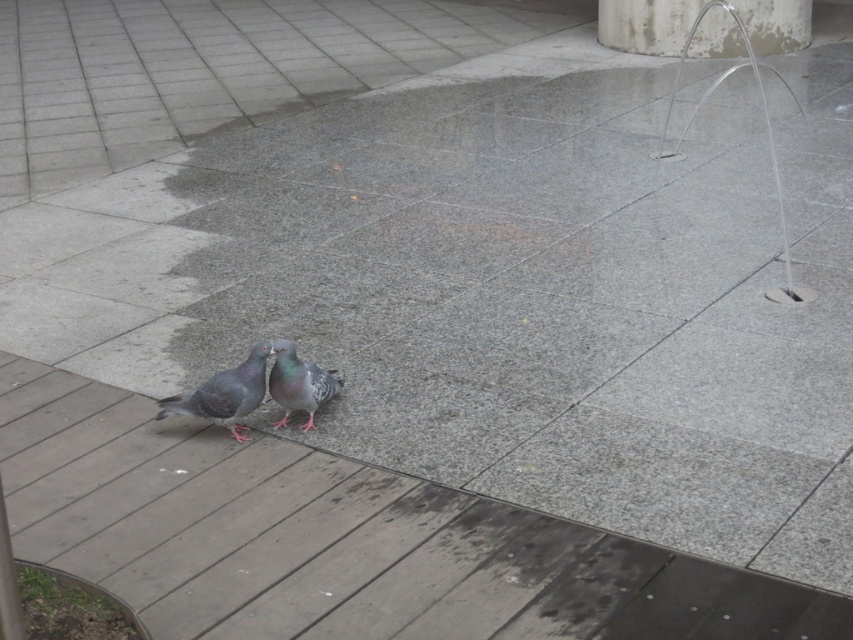
You are a photographer trying to capture both pigeons in a single shot. The pigeons are located at point (801, 42) and point (230, 376). Since you want to ensure both are fully visible, which pigeon should you position closer to the front of your camera frame?

Point (801, 42) is behind point (230, 376), so to ensure both pigeons are fully visible in the frame, you should position the pigeon at point (230, 376) closer to the front of the camera frame.